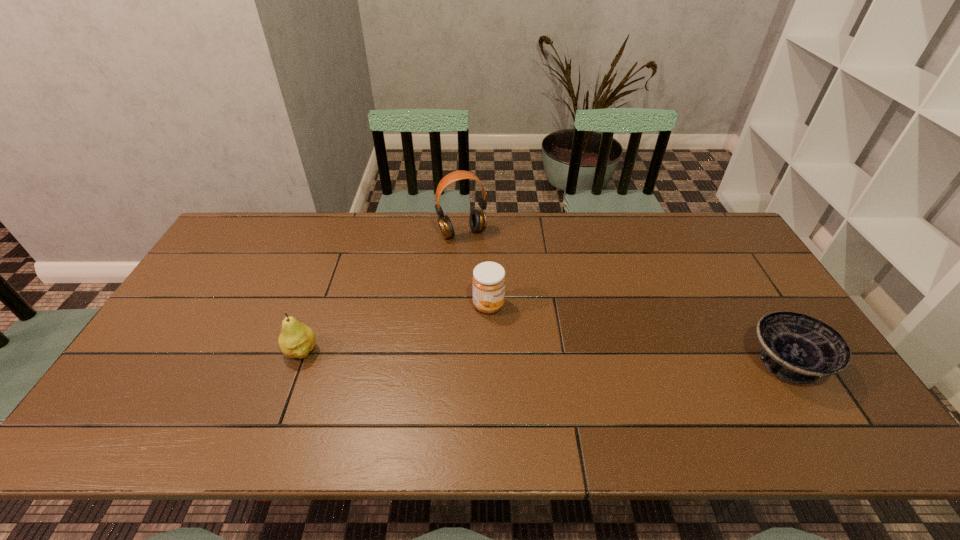
This screenshot has height=540, width=960. I want to click on vacant position located on the front label of the third nearest object, so click(x=526, y=325).

Find the location of `vacant area situated on the ear cups of the farthest object`. vacant area situated on the ear cups of the farthest object is located at coordinates (507, 312).

At what (x,y) coordinates should I click in order to perform the action: click on free space located on the ear cups of the farthest object. Please return your answer as a coordinate pair (x, y). This screenshot has width=960, height=540. Looking at the image, I should click on (511, 319).

Where is `vacant region located 0.160m on the ear cups of the farthest object`? vacant region located 0.160m on the ear cups of the farthest object is located at coordinates [487, 273].

Image resolution: width=960 pixels, height=540 pixels. Find the location of `object positioned at the far edge`. object positioned at the far edge is located at coordinates (478, 221).

At what (x,y) coordinates should I click in order to perform the action: click on object that is at the near edge. Please return your answer as a coordinate pair (x, y). Image resolution: width=960 pixels, height=540 pixels. Looking at the image, I should click on (797, 348).

Locate an element on the screen. object that is at the right edge is located at coordinates (797, 348).

You are a GUI agent. You are given a task and a screenshot of the screen. Output one action in this format:
    pyautogui.click(x=<x>, y=<y>)
    Task: Click on the object located in the near right corner section of the desktop
    
    Given the screenshot: What is the action you would take?
    pyautogui.click(x=797, y=348)

Where is `blank space at the far edge of the desktop`? blank space at the far edge of the desktop is located at coordinates (573, 219).

Identify the location of vacant area at the near edge. The width and height of the screenshot is (960, 540). (x=350, y=387).